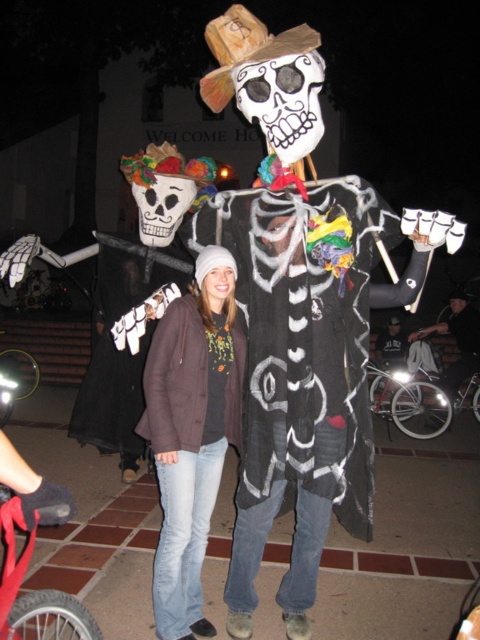
Between denim jeans at center and dark gray fabric pants at lower right, which one has more height?

denim jeans at center is taller.

Can you confirm if denim jeans at center is positioned to the right of dark gray fabric pants at lower right?

In fact, denim jeans at center is to the left of dark gray fabric pants at lower right.

Is point (188, 468) farther from camera compared to point (463, 296)?

No, it is in front of (463, 296).

Find the location of `denim jeans at center`. denim jeans at center is located at coordinates (192, 433).